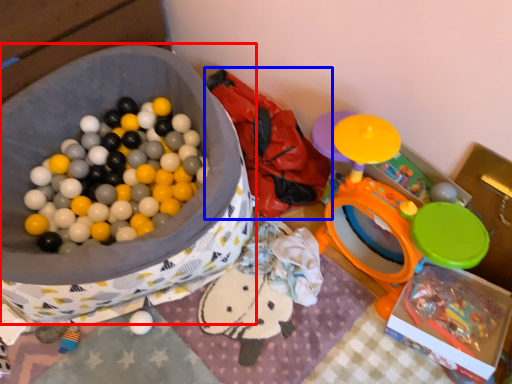
Question: Which point is closer to the camera, storage box (highlighted by a red box) or bean bag chair (highlighted by a blue box)?

Choices:
 (A) storage box
 (B) bean bag chair

Answer: (A)